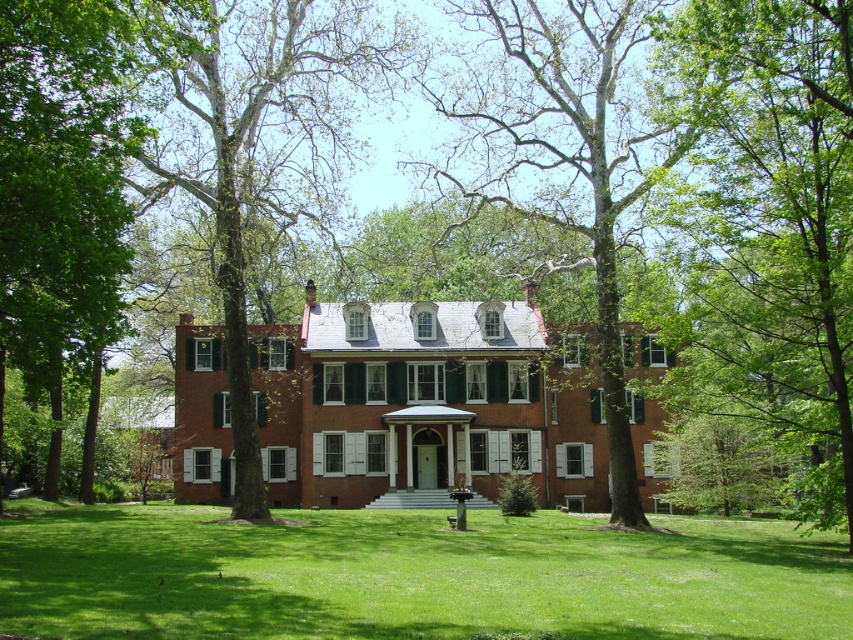
You are a landscape architect designing a pathway between the green leafy tree at left and the green leafy tree at center. Which tree requires a narrower pathway to accommodate its width?

The green leafy tree at left has a lesser width compared to the green leafy tree at center, so the pathway between them should be narrower near the green leafy tree at left to accommodate its smaller width.

You are standing in the garden of the house and looking towards the two trees. Which tree is closer to you, the green leafy tree at upper right or the smooth bark tree at center?

The green leafy tree at upper right is closer to you because it is in front of the smooth bark tree at center.

You are standing in front of the house and see two points marked on the roof. The first point is at coordinate point(772, 292) and the second is at point(613, 262). Which point is closer to you?

Point(772, 292) is in front of point(613, 262), so it is closer to you.